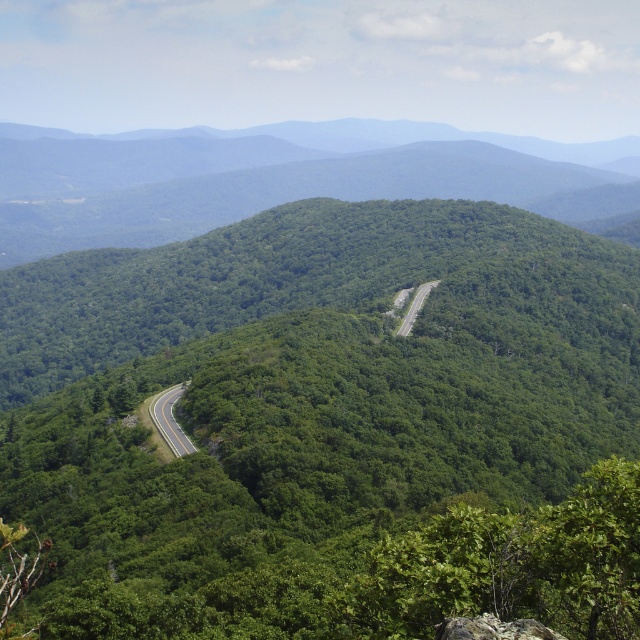
Is smooth asphalt road at center positioned in front of green asphalt road at center?

Yes, smooth asphalt road at center is in front of green asphalt road at center.

Which is in front, point (179, 448) or point (413, 298)?

Point (179, 448)

I want to click on smooth asphalt road at center, so click(x=170, y=419).